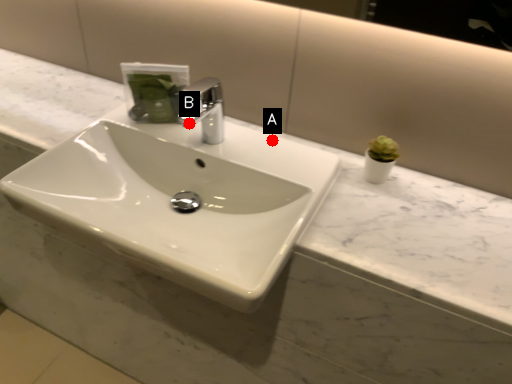
Question: Two points are circled on the image, labeled by A and B beside each circle. Among these points, which one is nearest to the camera?

Choices:
 (A) A is closer
 (B) B is closer

Answer: (A)